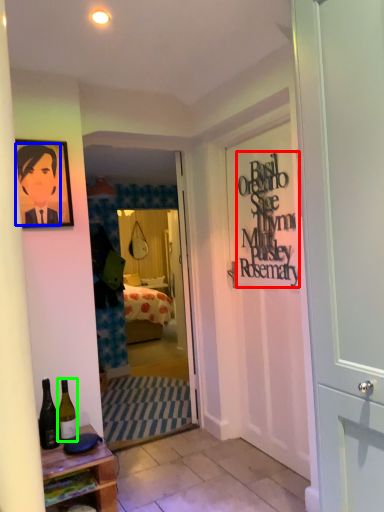
Question: Estimate the real-world distances between objects in this image. Which object is farther from writing (highlighted by a red box), person (highlighted by a blue box) or bottle (highlighted by a green box)?

Choices:
 (A) person
 (B) bottle

Answer: (B)